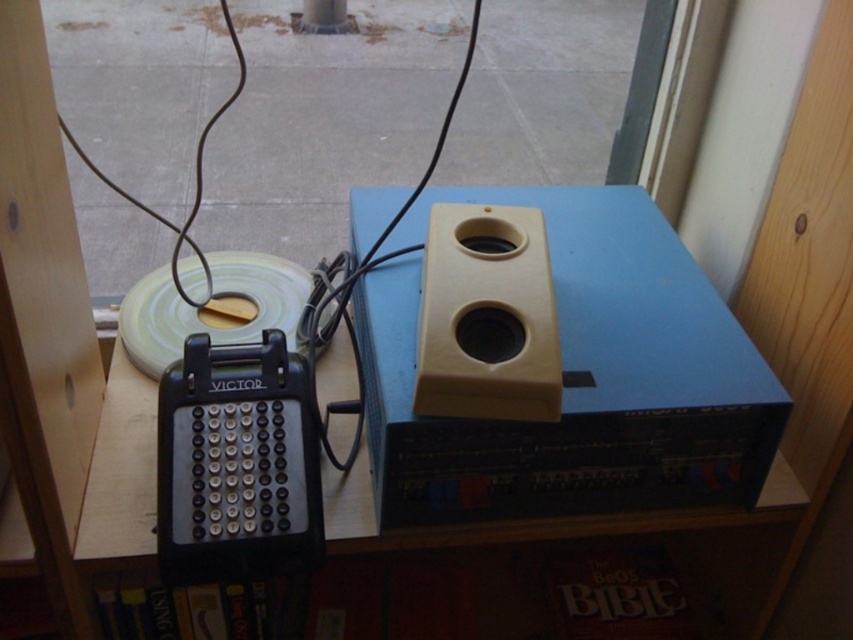
Question: Among these objects, which one is nearest to the camera?

Choices:
 (A) beige plastic speaker at center
 (B) beige plastic speaker at upper center
 (C) white matte tape at center

Answer: (A)

Question: Can you confirm if beige plastic speaker at upper center is wider than wooden table at center?

Choices:
 (A) yes
 (B) no

Answer: (B)

Question: Can you confirm if beige plastic speaker at center is positioned to the right of wooden table at center?

Choices:
 (A) no
 (B) yes

Answer: (B)

Question: Estimate the real-world distances between objects in this image. Which object is closer to the wooden table at center?

Choices:
 (A) beige plastic speaker at upper center
 (B) beige plastic speaker at center

Answer: (A)

Question: Which object appears closest to the camera in this image?

Choices:
 (A) wooden table at center
 (B) beige plastic speaker at upper center

Answer: (B)

Question: Can you confirm if beige plastic speaker at upper center is positioned below beige plastic speaker at center?

Choices:
 (A) yes
 (B) no

Answer: (A)